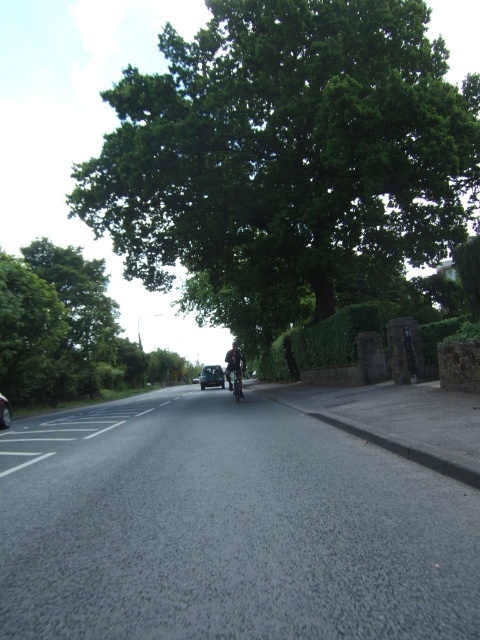
Between green leafy tree at upper center and metallic silver car at center, which one appears on the right side from the viewer's perspective?

Positioned to the right is metallic silver car at center.

Is point (12, 368) closer to camera compared to point (213, 381)?

Yes, it is in front of point (213, 381).

Locate an element on the screen. green leafy tree at upper center is located at coordinates (66, 330).

Which is in front, point (428, 173) or point (84, 355)?

Point (428, 173)

The height and width of the screenshot is (640, 480). What are the coordinates of `green leafy tree at center` in the screenshot? It's located at (285, 157).

Locate an element on the screen. This screenshot has height=640, width=480. green leafy tree at center is located at coordinates (285, 157).

Measure the distance between green leafy tree at center and metallic silver motorcycle at center.

They are 11.33 meters apart.

Can you confirm if green leafy tree at center is positioned below metallic silver motorcycle at center?

No, green leafy tree at center is not below metallic silver motorcycle at center.

Does point (417, 81) lie behind point (232, 384)?

Yes, point (417, 81) is farther from viewer.

Identify the location of green leafy tree at center. Image resolution: width=480 pixels, height=640 pixels. (285, 157).